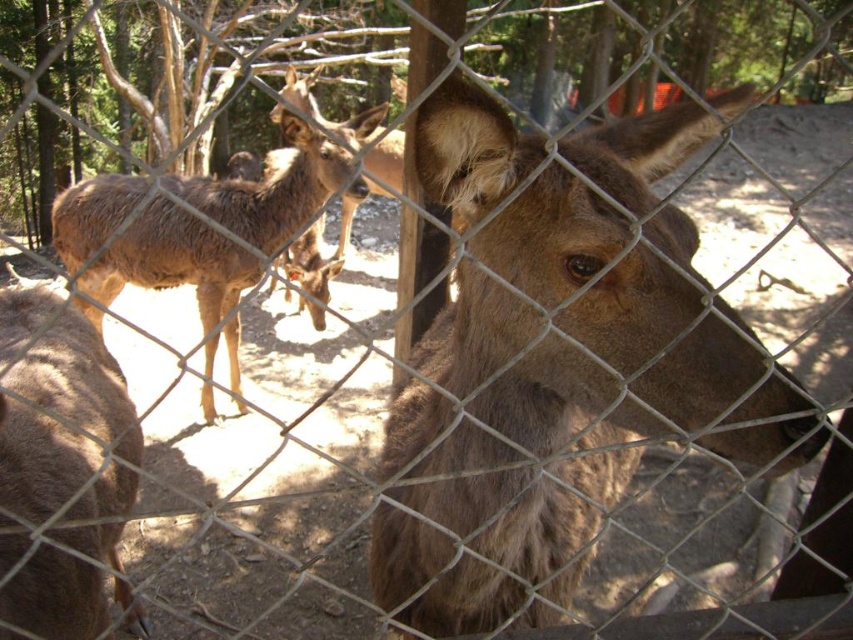
Is brown fuzzy deer at center above brown fur deer at center?

No.

Can you confirm if brown fuzzy deer at center is positioned to the left of brown fur deer at center?

Incorrect, brown fuzzy deer at center is not on the left side of brown fur deer at center.

Does point (589, 243) come in front of point (248, 253)?

That is True.

Identify the location of brown fuzzy deer at center. The height and width of the screenshot is (640, 853). (549, 360).